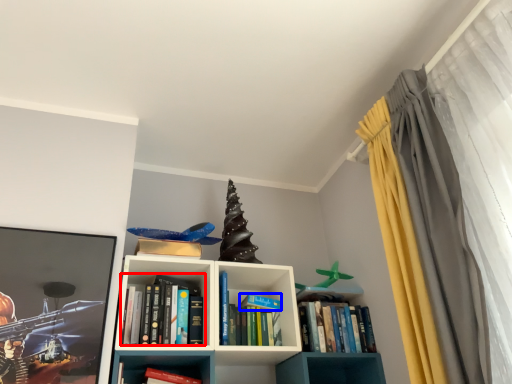
Question: Which object is further to the camera taking this photo, book (highlighted by a red box) or paperback book (highlighted by a blue box)?

Choices:
 (A) book
 (B) paperback book

Answer: (B)